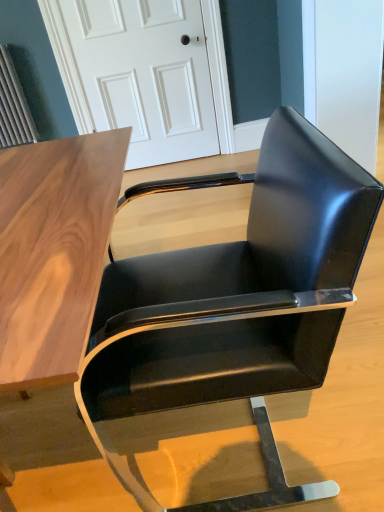
The height and width of the screenshot is (512, 384). What do you see at coordinates (231, 313) in the screenshot?
I see `glossy black chair at center` at bounding box center [231, 313].

Where is `glossy black chair at center`? glossy black chair at center is located at coordinates (231, 313).

Measure the distance between glossy black chair at center and camera.

glossy black chair at center is 20.73 inches from camera.

This screenshot has width=384, height=512. Describe the element at coordinates (137, 74) in the screenshot. I see `white glossy door at upper center` at that location.

Where is `white glossy door at upper center`? white glossy door at upper center is located at coordinates (137, 74).

At what (x,y) coordinates should I click in order to perform the action: click on glossy black chair at center. Please return your answer as a coordinate pair (x, y). The width and height of the screenshot is (384, 512). Looking at the image, I should click on (231, 313).

Which object is positioned more to the right, white glossy door at upper center or glossy black chair at center?

glossy black chair at center.

Relative to glossy black chair at center, is white glossy door at upper center in front or behind?

white glossy door at upper center is behind glossy black chair at center.

Is point (51, 3) more distant than point (261, 291)?

Yes, point (51, 3) is behind point (261, 291).

From the image's perspective, which is below, white glossy door at upper center or glossy black chair at center?

glossy black chair at center.

From a real-world perspective, between white glossy door at upper center and glossy black chair at center, who is vertically lower?

glossy black chair at center, from a real-world perspective.

Can you confirm if white glossy door at upper center is wider than glossy black chair at center?

Incorrect, the width of white glossy door at upper center does not surpass that of glossy black chair at center.

Between white glossy door at upper center and glossy black chair at center, which one has more height?

white glossy door at upper center is taller.

Considering the sizes of objects white glossy door at upper center and glossy black chair at center in the image provided, who is smaller, white glossy door at upper center or glossy black chair at center?

white glossy door at upper center is smaller.

Choose the correct answer: Is white glossy door at upper center inside glossy black chair at center or outside it?

white glossy door at upper center is located beyond the bounds of glossy black chair at center.

Is white glossy door at upper center directly adjacent to glossy black chair at center?

No.

Is white glossy door at upper center oriented towards glossy black chair at center?

Yes, white glossy door at upper center is facing glossy black chair at center.

Locate an element on the screen. Image resolution: width=384 pixels, height=512 pixels. chair in front of the white glossy door at upper center is located at coordinates (231, 313).

Can you confirm if glossy black chair at center is positioned to the right of white glossy door at upper center?

Yes.

Is glossy black chair at center positioned before white glossy door at upper center?

Yes, glossy black chair at center is closer to the camera.

Between point (113, 445) and point (189, 142), which one is positioned behind?

The point (189, 142) is behind.

From the image's perspective, which is below, glossy black chair at center or white glossy door at upper center?

glossy black chair at center appears lower in the image.

From a real-world perspective, is glossy black chair at center physically below white glossy door at upper center?

Correct, in the physical world, glossy black chair at center is lower than white glossy door at upper center.

Looking at this image, can you confirm if glossy black chair at center is thinner than white glossy door at upper center?

In fact, glossy black chair at center might be wider than white glossy door at upper center.

In terms of height, does glossy black chair at center look taller or shorter compared to white glossy door at upper center?

glossy black chair at center is shorter than white glossy door at upper center.

Which of these two, glossy black chair at center or white glossy door at upper center, is bigger?

glossy black chair at center.

Is white glossy door at upper center inside glossy black chair at center?

No, white glossy door at upper center is not surrounded by glossy black chair at center.

Consider the image. Are glossy black chair at center and white glossy door at upper center far apart?

Yes, glossy black chair at center is far from white glossy door at upper center.

Is glossy black chair at center turned away from white glossy door at upper center?

No, glossy black chair at center is not facing away from white glossy door at upper center.

Can you tell me how much glossy black chair at center and white glossy door at upper center differ in facing direction?

88.5 degrees separate the facing orientations of glossy black chair at center and white glossy door at upper center.

Based on the photo, how far apart are glossy black chair at center and white glossy door at upper center?

glossy black chair at center and white glossy door at upper center are 6.32 feet apart.

The image size is (384, 512). I want to click on door to the left of glossy black chair at center, so click(137, 74).

Where is `door above the glossy black chair at center (from a real-world perspective)`? This screenshot has height=512, width=384. door above the glossy black chair at center (from a real-world perspective) is located at coordinates (137, 74).

Locate an element on the screen. This screenshot has height=512, width=384. door on the left side of glossy black chair at center is located at coordinates (137, 74).